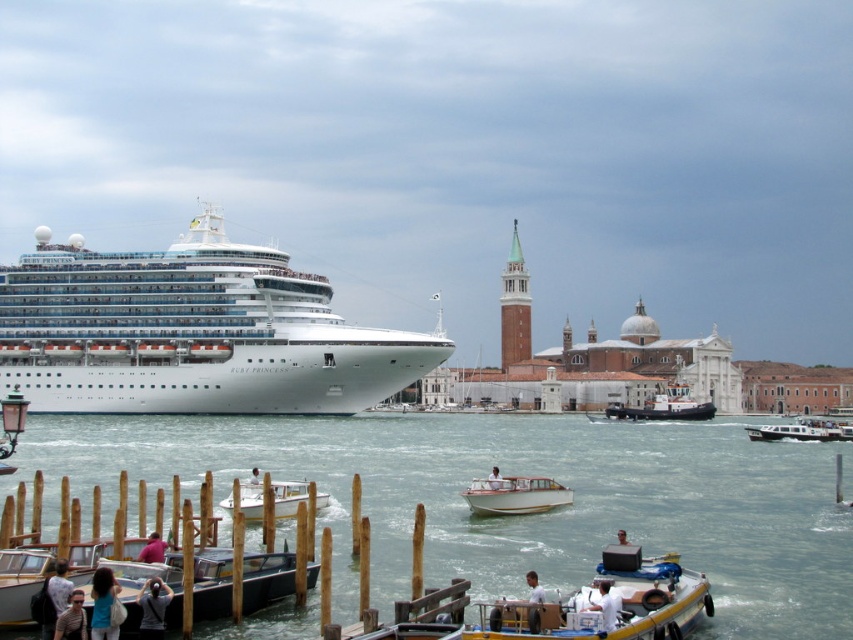
Question: Among these objects, which one is farthest from the camera?

Choices:
 (A) white glossy cruise ship at left
 (B) matte gray shirt at lower left

Answer: (A)

Question: Is wooden dock at lower left further to the viewer compared to dark gray fabric shirt at lower left?

Choices:
 (A) no
 (B) yes

Answer: (B)

Question: Which point is farther to the camera?

Choices:
 (A) white glossy motorboat at lower right
 (B) light blue shirt at lower left
 (C) matte gray shirt at lower left

Answer: (A)

Question: Is clear water at lower center to the right of blue denim shirt at lower left from the viewer's perspective?

Choices:
 (A) no
 (B) yes

Answer: (B)

Question: Is the position of blue denim shirt at lower left more distant than that of light brown wooden boat at lower center?

Choices:
 (A) yes
 (B) no

Answer: (B)

Question: Which point is farther to the camera?

Choices:
 (A) (91, 589)
 (B) (140, 634)
 (C) (293, 580)

Answer: (C)